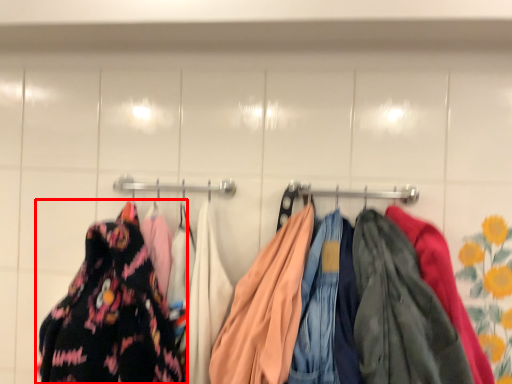
Question: In this image, where is fancy dress (annotated by the red box) located relative to laundry?

Choices:
 (A) left
 (B) right

Answer: (A)